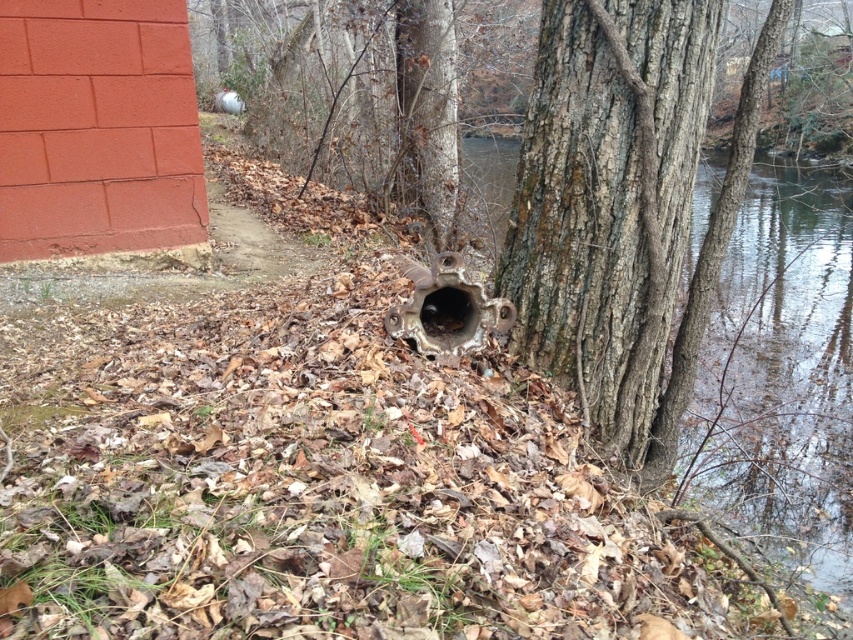
You are a maintenance worker needing to reach the metallic pipe at center from the transparent water at tree right. Can you walk directly to it without any obstacles?

The distance between transparent water at tree right and metallic pipe at center is 3.38 meters, so you can walk directly to it without any obstacles as there is enough space.

You are standing in the outdoor scene described. There is a point at coordinates [608,202]. What object is located at that point?

The dark brown rough bark at center is located at point [608,202].

You are a hiker who needs to cross a stream. You see the dark brown rough bark at center and the transparent water at tree right. Which object is taller, and can you use the taller one to help cross the stream?

The transparent water at tree right is taller than the dark brown rough bark at center. Since the water is taller, it might indicate a deeper part of the stream, so it would be safer to avoid that area and use the shorter bark as a stepping stone if possible.